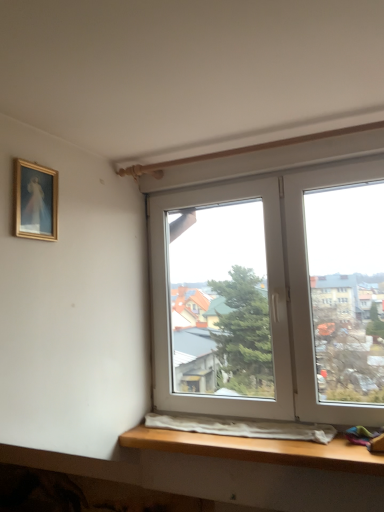
Question: Should I look upward or downward to see gold-framed painting at upper left?

Choices:
 (A) down
 (B) up

Answer: (B)